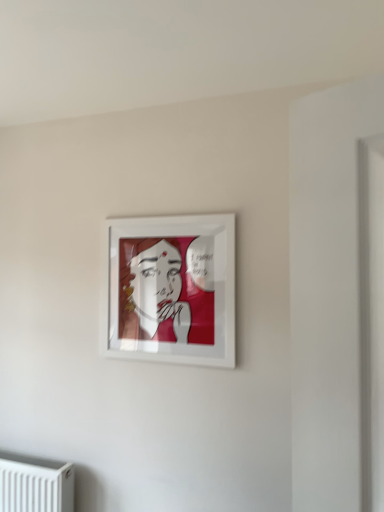
Locate an element on the screen. The width and height of the screenshot is (384, 512). white glossy picture frame at upper center is located at coordinates coord(170,289).

This screenshot has height=512, width=384. What do you see at coordinates (170, 289) in the screenshot?
I see `white glossy picture frame at upper center` at bounding box center [170, 289].

The height and width of the screenshot is (512, 384). Find the location of `white glossy picture frame at upper center`. white glossy picture frame at upper center is located at coordinates (170, 289).